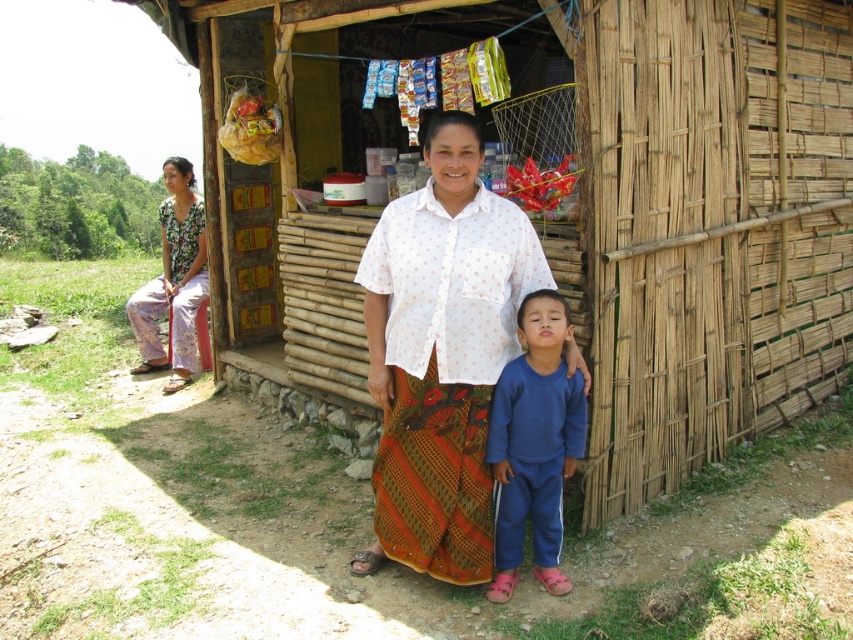
You are standing in front of the bamboo stall and want to find the blue fleece pants at lower right. Where should you look relative to the stall?

The blue fleece pants at lower right are located at the 2D coordinates point (532, 444) relative to the stall.

From the picture: Please look at the image and focus on the point at coordinates (532, 444). What object is located at that specific point?

The blue fleece pants at lower right are located at point (532, 444).